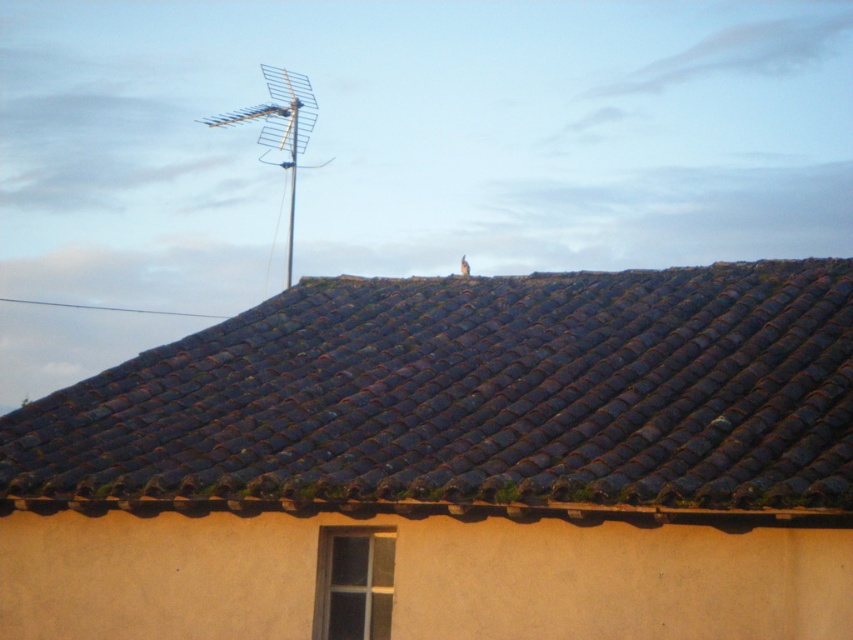
Question: Is brown tile roof at upper center wider than metallic antenna at upper center?

Choices:
 (A) yes
 (B) no

Answer: (A)

Question: Among these points, which one is nearest to the camera?

Choices:
 (A) (190, 371)
 (B) (271, 97)

Answer: (A)

Question: Among these points, which one is farthest from the camera?

Choices:
 (A) (233, 122)
 (B) (251, 412)

Answer: (A)

Question: Is brown tile roof at upper center closer to camera compared to metallic antenna at upper center?

Choices:
 (A) yes
 (B) no

Answer: (A)

Question: Can you confirm if brown tile roof at upper center is positioned to the right of metallic antenna at upper center?

Choices:
 (A) yes
 (B) no

Answer: (A)

Question: Among these points, which one is farthest from the camera?

Choices:
 (A) tap(463, 374)
 (B) tap(281, 72)

Answer: (B)